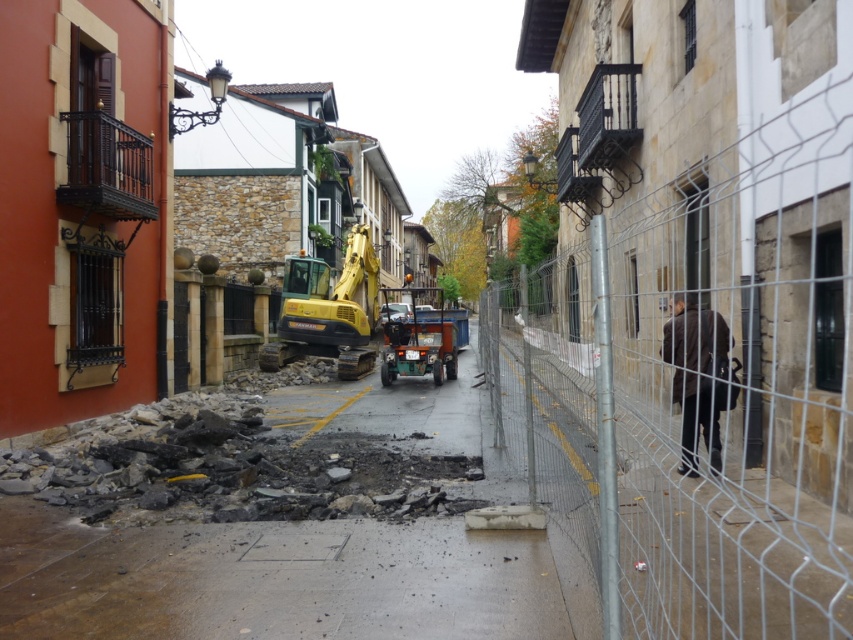
Question: Which of the following is the farthest from the observer?

Choices:
 (A) yellow-green metal excavator at center
 (B) green rubber utility vehicle at center
 (C) wire mesh fence at right

Answer: (A)

Question: Which point appears farthest from the camera in this image?

Choices:
 (A) (363, 236)
 (B) (715, 573)
 (C) (409, 310)
 (D) (387, 625)

Answer: (C)

Question: Which object is the closest to the green rubber utility vehicle at center?

Choices:
 (A) wire mesh fence at right
 (B) yellow-green metal excavator at center
 (C) dark gray rubble at center

Answer: (A)

Question: Can you confirm if broken asphalt at center is positioned to the right of yellow-green metal excavator at center?

Choices:
 (A) no
 (B) yes

Answer: (B)

Question: In this image, where is wire mesh fence at right located relative to dark brown leather jacket at right?

Choices:
 (A) right
 (B) left

Answer: (A)

Question: Considering the relative positions of wire mesh fence at right and yellow-green metal excavator at center in the image provided, where is wire mesh fence at right located with respect to yellow-green metal excavator at center?

Choices:
 (A) above
 (B) below

Answer: (A)